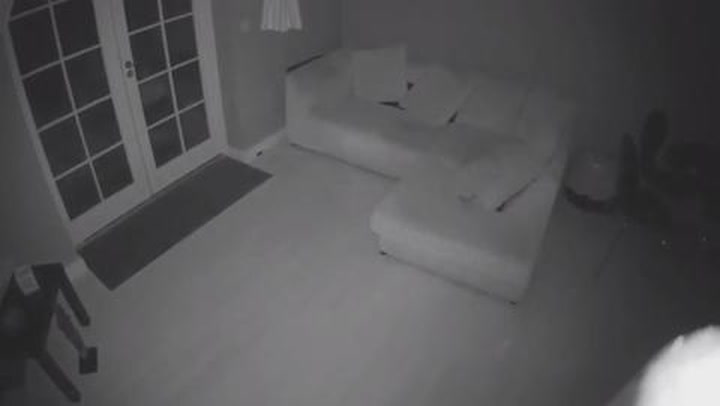
You are a GUI agent. You are given a task and a screenshot of the screen. Output one action in this format:
    pyautogui.click(x=<x>, y=<y>)
    Task: Click on the door lock
    
    Given the screenshot: What is the action you would take?
    pyautogui.click(x=127, y=66)